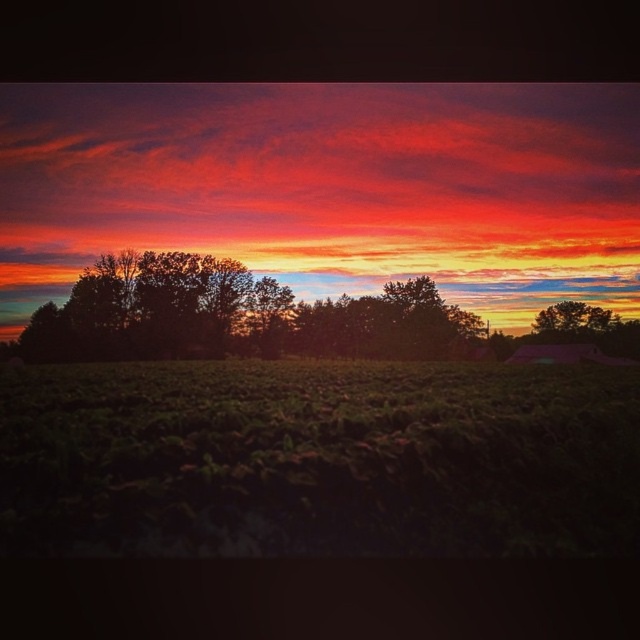
Can you confirm if vivid orange cloud at upper center is positioned to the left of green leafy tree at right?

Yes, vivid orange cloud at upper center is to the left of green leafy tree at right.

Which is in front, point (417, 168) or point (604, 314)?

Positioned in front is point (417, 168).

Find the location of a particular element. vivid orange cloud at upper center is located at coordinates (330, 188).

Does dark green grass at lower center have a greater height compared to green leafy tree at right?

No, dark green grass at lower center is not taller than green leafy tree at right.

Does dark green grass at lower center have a greater width compared to green leafy tree at right?

Correct, the width of dark green grass at lower center exceeds that of green leafy tree at right.

Who is more distant from viewer, (595, 518) or (561, 307)?

Positioned behind is point (561, 307).

What are the coordinates of `dark green grass at lower center` in the screenshot? It's located at (317, 458).

Is vivid orange cloud at upper center bigger than dark green grass at lower center?

Indeed, vivid orange cloud at upper center has a larger size compared to dark green grass at lower center.

Can you confirm if vivid orange cloud at upper center is thinner than dark green grass at lower center?

Incorrect, vivid orange cloud at upper center's width is not less than dark green grass at lower center's.

In order to click on vivid orange cloud at upper center in this screenshot , I will do `click(330, 188)`.